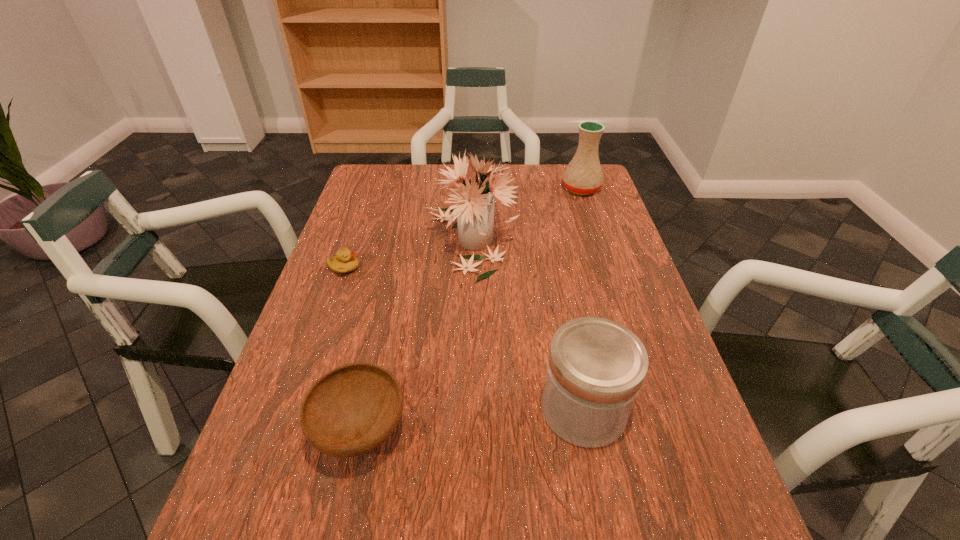
This screenshot has height=540, width=960. Identify the location of free spot located 0.200m on the right of the bowl. (515, 430).

Locate an element on the screen. Image resolution: width=960 pixels, height=540 pixels. blank space located 0.280m at the beak of the shortest object is located at coordinates (466, 268).

Find the location of `object that is positioned at the far edge`. object that is positioned at the far edge is located at coordinates tap(583, 176).

Locate an element on the screen. Image resolution: width=960 pixels, height=540 pixels. bowl at the left edge is located at coordinates (351, 410).

Find the location of a particular element. The height and width of the screenshot is (540, 960). duckling located at the left edge is located at coordinates (345, 261).

Image resolution: width=960 pixels, height=540 pixels. I want to click on pottery positioned at the right edge, so click(583, 176).

You are a GUI agent. You are given a task and a screenshot of the screen. Output one action in this format:
    pyautogui.click(x=<x>, y=<y>)
    Task: Click on the jar present at the right edge
    
    Given the screenshot: What is the action you would take?
    pyautogui.click(x=596, y=367)

In order to click on object located in the far right corner section of the desktop in this screenshot , I will do `click(583, 176)`.

Locate an element on the screen. free spot at the far edge of the desktop is located at coordinates (427, 171).

Identify the location of vacant space at the left edge of the desktop. The width and height of the screenshot is (960, 540). [259, 514].